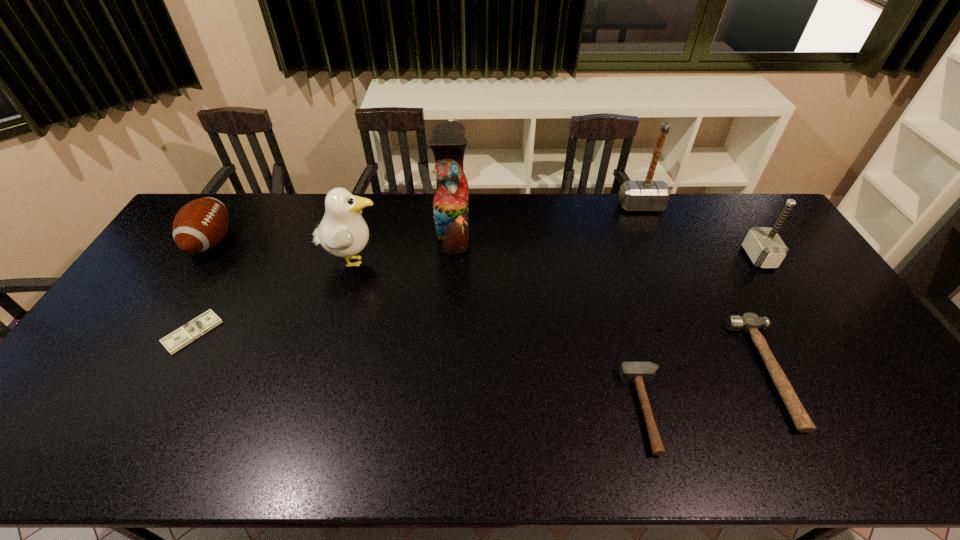
Where is `dollar`? dollar is located at coordinates pyautogui.click(x=184, y=335).

This screenshot has height=540, width=960. I want to click on vacant space located 0.370m at the face of the parrot, so click(576, 232).

At what (x,y) coordinates should I click in order to perform the action: click on vacant space located on the striking surface of the second hammer from left to right. Please return your answer as a coordinate pair (x, y). Image resolution: width=960 pixels, height=540 pixels. Looking at the image, I should click on (657, 245).

Locate an element on the screen. The height and width of the screenshot is (540, 960). vacant space located on the beak of the gull is located at coordinates (419, 261).

The image size is (960, 540). In order to click on vacant space located for striking with the head of the rightmost hammer in this screenshot , I will do `click(701, 257)`.

The height and width of the screenshot is (540, 960). Identify the location of vacant space located 0.360m for striking with the head of the rightmost hammer. (636, 257).

Find the location of a particular element. This screenshot has height=540, width=960. vacant space situated for striking with the head of the rightmost hammer is located at coordinates (677, 257).

Where is `free spot located 0.150m on the laces of the fifth tallest object`? free spot located 0.150m on the laces of the fifth tallest object is located at coordinates click(277, 241).

Locate an element on the screen. free region located on the striking face of the second object from right to left is located at coordinates (662, 372).

Where is `vacant space located on the striking face of the second object from right to left`? The width and height of the screenshot is (960, 540). vacant space located on the striking face of the second object from right to left is located at coordinates (651, 372).